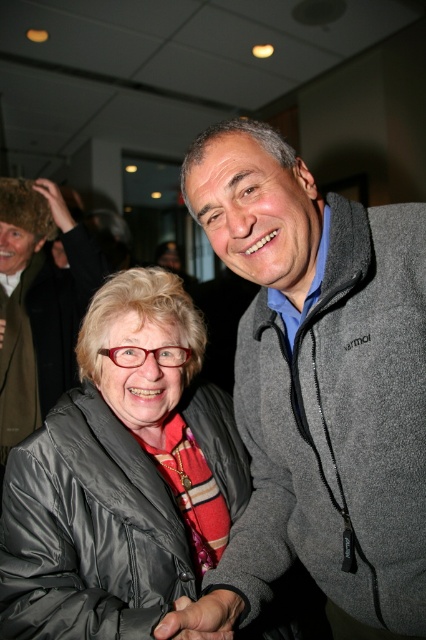
Question: Which point appears farthest from the camera in this image?

Choices:
 (A) (166, 369)
 (B) (25, 365)
 (C) (285, 148)

Answer: (B)

Question: Does gray fleece jacket at right have a lesser width compared to gray fleece jacket at upper right?

Choices:
 (A) no
 (B) yes

Answer: (B)

Question: Which object is closer to the camera taking this photo?

Choices:
 (A) gray fleece jacket at upper right
 (B) matte black jacket at center

Answer: (B)

Question: From the image, what is the correct spatial relationship of gray fleece jacket at right in relation to gray fleece jacket at upper right?

Choices:
 (A) left
 (B) right

Answer: (B)

Question: Is gray fleece jacket at right wider than gray fleece jacket at upper right?

Choices:
 (A) yes
 (B) no

Answer: (B)

Question: Among these points, which one is nearest to the camera?

Choices:
 (A) (345, 454)
 (B) (244, 465)
 (C) (8, 353)

Answer: (A)